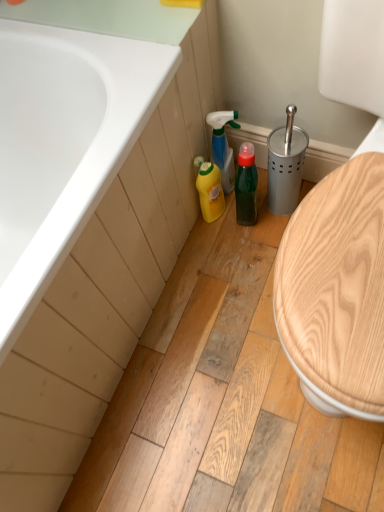
I want to click on free spot in front of yellow plastic bottle at lower center, the 2th cleaning product when ordered from top to bottom, so click(x=228, y=259).